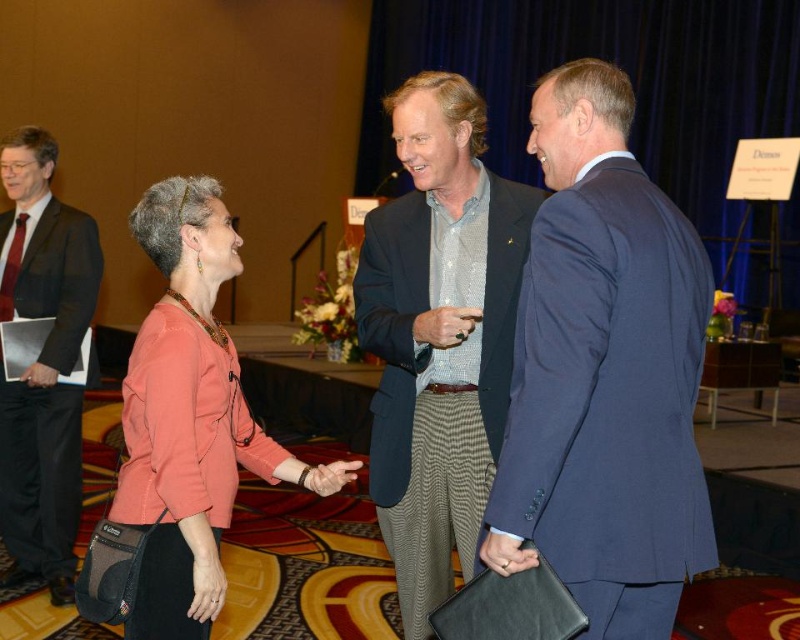
You are a photographer at a formal event. You need to capture a photo of the textured wool blazer at center and the dark gray suit at left. Based on their positions, which one is higher in the image?

The textured wool blazer at center is located above the dark gray suit at left, so it is higher in the image.